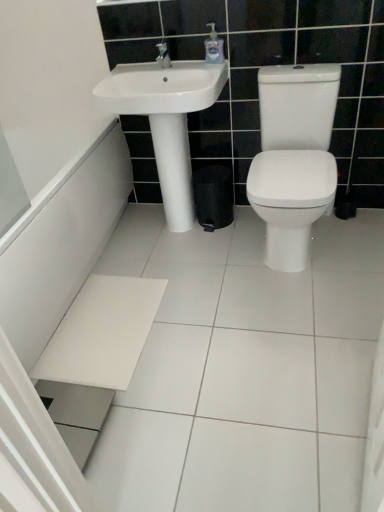
Question: Considering the relative sizes of white glossy sink at upper center and white ceramic tile at lower center in the image provided, is white glossy sink at upper center shorter than white ceramic tile at lower center?

Choices:
 (A) yes
 (B) no

Answer: (B)

Question: Is white glossy sink at upper center located outside white ceramic tile at lower center?

Choices:
 (A) yes
 (B) no

Answer: (A)

Question: Considering the relative sizes of white glossy sink at upper center and white ceramic tile at lower center in the image provided, is white glossy sink at upper center bigger than white ceramic tile at lower center?

Choices:
 (A) no
 (B) yes

Answer: (A)

Question: Considering the relative positions of white glossy sink at upper center and white ceramic tile at lower center in the image provided, is white glossy sink at upper center behind white ceramic tile at lower center?

Choices:
 (A) yes
 (B) no

Answer: (A)

Question: Is the depth of white glossy sink at upper center less than that of white ceramic tile at lower center?

Choices:
 (A) no
 (B) yes

Answer: (A)

Question: Is white glossy sink at upper center wider than white ceramic tile at lower center?

Choices:
 (A) no
 (B) yes

Answer: (A)

Question: Does clear plastic soap dispenser at upper center have a larger size compared to white glossy sink at upper center?

Choices:
 (A) no
 (B) yes

Answer: (A)

Question: Is clear plastic soap dispenser at upper center smaller than white glossy sink at upper center?

Choices:
 (A) yes
 (B) no

Answer: (A)

Question: Considering the relative positions of clear plastic soap dispenser at upper center and white glossy sink at upper center in the image provided, is clear plastic soap dispenser at upper center in front of white glossy sink at upper center?

Choices:
 (A) yes
 (B) no

Answer: (B)

Question: Is clear plastic soap dispenser at upper center oriented away from white glossy sink at upper center?

Choices:
 (A) yes
 (B) no

Answer: (B)

Question: Could you tell me if clear plastic soap dispenser at upper center is turned towards white glossy sink at upper center?

Choices:
 (A) yes
 (B) no

Answer: (B)

Question: From a real-world perspective, does clear plastic soap dispenser at upper center sit lower than white glossy sink at upper center?

Choices:
 (A) no
 (B) yes

Answer: (A)

Question: Does white glossy bath at lower left turn towards white ceramic tile at lower center?

Choices:
 (A) yes
 (B) no

Answer: (A)